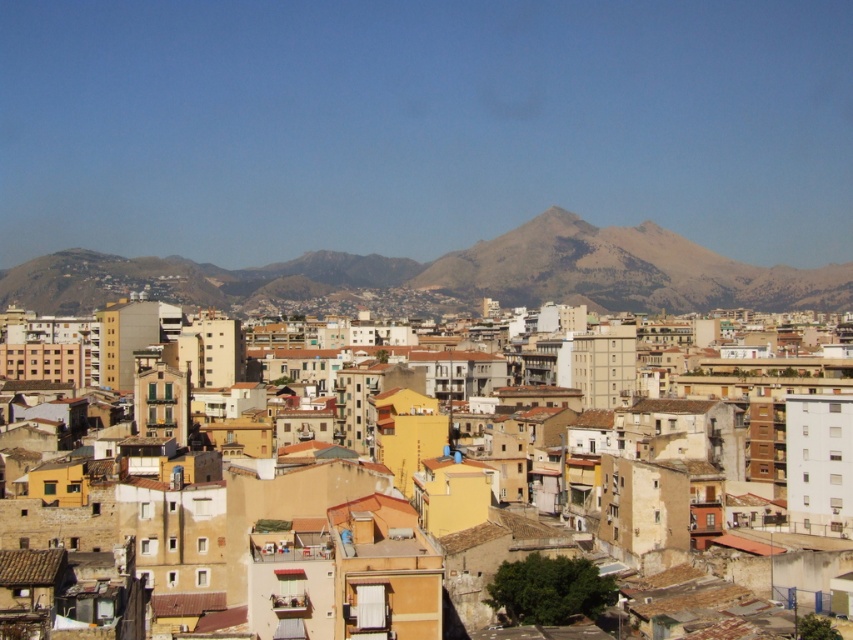
Which is above, gray rocky mountain at center or matte yellow building at center?

gray rocky mountain at center

The height and width of the screenshot is (640, 853). Describe the element at coordinates (456, 273) in the screenshot. I see `gray rocky mountain at center` at that location.

Does point (553, 209) come behind point (51, 346)?

Yes, point (553, 209) is farther from viewer.

In order to click on gray rocky mountain at center in this screenshot , I will do `click(456, 273)`.